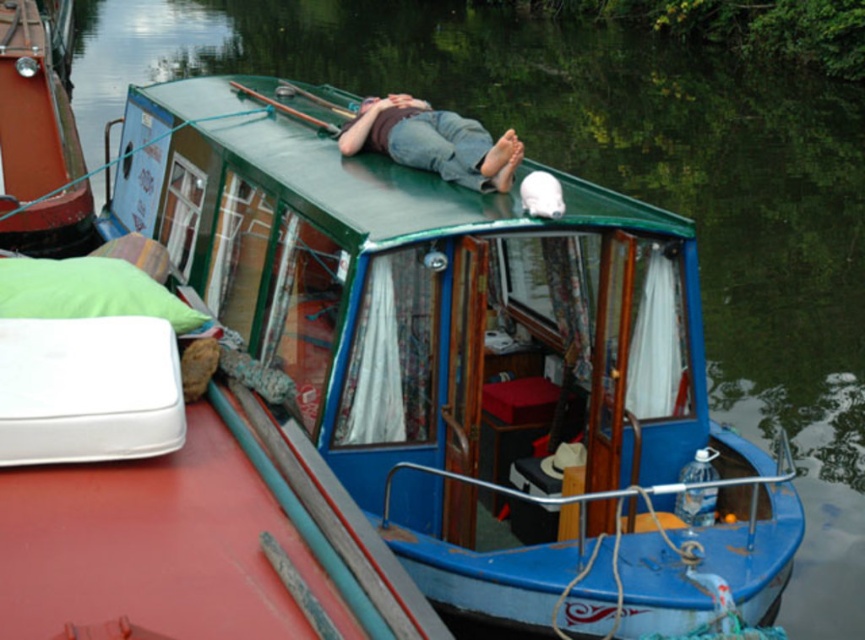
Can you confirm if blue glossy boat at upper center is positioned above denim jeans at center?

No.

From the picture: Who is more distant from viewer, (x=300, y=556) or (x=395, y=141)?

The point (x=395, y=141) is behind.

Who is more distant from viewer, (225,460) or (500,177)?

The point (500,177) is behind.

Where is `blue glossy boat at upper center`? This screenshot has width=865, height=640. blue glossy boat at upper center is located at coordinates (202, 544).

In the scene shown: Does blue glossy boat at upper center lie behind green fabric pillow at left?

That is False.

This screenshot has height=640, width=865. What do you see at coordinates (202, 544) in the screenshot?
I see `blue glossy boat at upper center` at bounding box center [202, 544].

Is point (127, 577) farther from viewer compared to point (63, 272)?

That is False.

Find the location of `blue glossy boat at upper center`. blue glossy boat at upper center is located at coordinates (202, 544).

Who is positioned more to the left, blue painted wooden cabin cruiser at upper center or denim jeans at center?

From the viewer's perspective, blue painted wooden cabin cruiser at upper center appears more on the left side.

Is blue painted wooden cabin cruiser at upper center shorter than denim jeans at center?

No.

The width and height of the screenshot is (865, 640). Describe the element at coordinates (471, 360) in the screenshot. I see `blue painted wooden cabin cruiser at upper center` at that location.

In order to click on blue painted wooden cabin cruiser at upper center in this screenshot , I will do `click(471, 360)`.